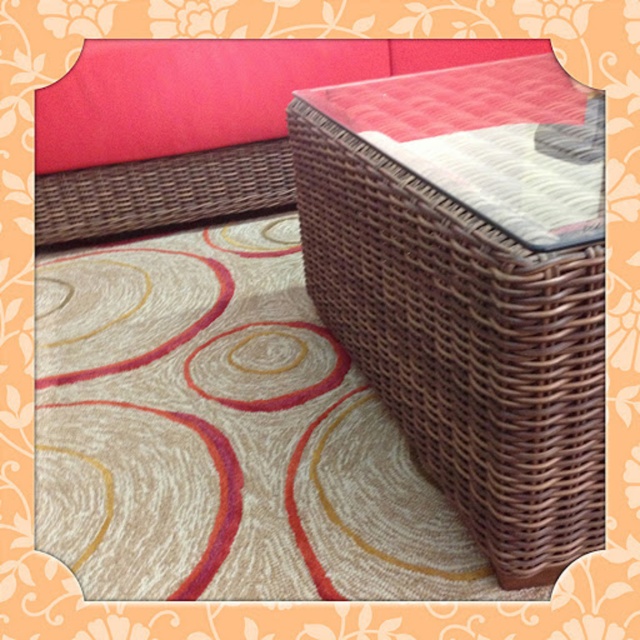
You are planning to place a large potted plant in the room. The plant requires a space that is larger than the brown woven basket at center. Can the brown wicker couch at upper center accommodate the plant?

The brown woven basket at center is bigger than the brown wicker couch at upper center. Since the plant requires a space larger than the basket, the brown wicker couch at upper center is not big enough to accommodate the plant.

You are a delivery person trying to place a package that is 30 inches long between the brown woven basket at center and the brown wicker couch at upper center. Based on the space available, will the package fit without overlapping either object?

The distance between the brown woven basket at center and the brown wicker couch at upper center is 33.11 inches. Since the package is 30 inches long, it will fit within the space as there is enough room without overlapping either object.

You are standing in the room and want to place a 12 inch tall decoration on the brown woven basket at center. Can you do that?

The brown woven basket at center and viewer are 19.24 inches apart. Since the decoration is 12 inches tall, it can be placed on the basket as long as the basket itself is stable enough to support it. However, the distance between you and the basket doesn